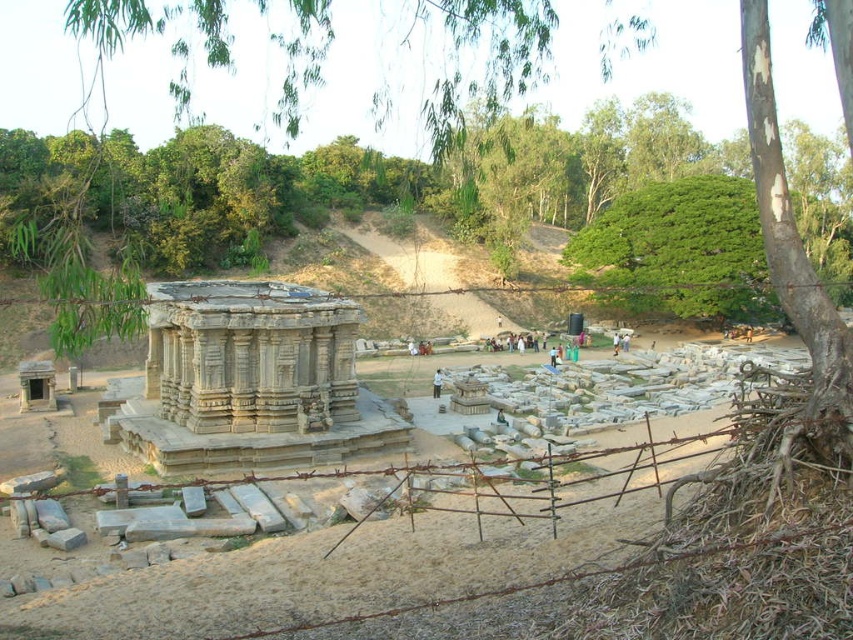
Question: Which of these objects is positioned closest to the gray stone amphitheater at center?

Choices:
 (A) green leafy tree at upper center
 (B) white fabric shirt at center
 (C) dark gray stone statue at center

Answer: (B)

Question: Does gray stone amphitheater at center appear on the right side of white fabric shirt at center?

Choices:
 (A) no
 (B) yes

Answer: (A)

Question: Estimate the real-world distances between objects in this image. Which object is farther from the gray stone amphitheater at center?

Choices:
 (A) white fabric shirt at center
 (B) green leafy tree at upper center

Answer: (B)

Question: Is gray stone amphitheater at center further to the viewer compared to dark gray stone statue at center?

Choices:
 (A) no
 (B) yes

Answer: (A)

Question: Estimate the real-world distances between objects in this image. Which object is closer to the gray stone amphitheater at center?

Choices:
 (A) dark gray stone statue at center
 (B) white fabric shirt at center

Answer: (B)

Question: Where is green leafy tree at upper center located in relation to dark gray stone statue at center in the image?

Choices:
 (A) right
 (B) left

Answer: (B)